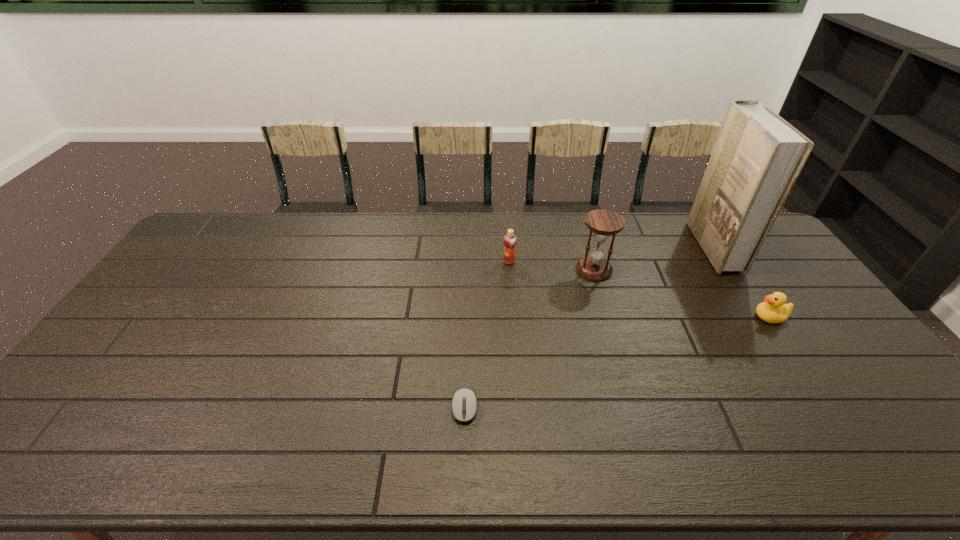
This screenshot has width=960, height=540. Find the location of `free space between the third object from right to left and the leftmost object`. free space between the third object from right to left and the leftmost object is located at coordinates (529, 338).

Identify the location of free spot between the tallest object and the second object from left to right. (612, 254).

In order to click on blank region between the duck and the fourth object from right to left in this screenshot , I will do `click(639, 289)`.

Find the location of a particular element. The image size is (960, 540). free space between the tallest object and the second object from left to right is located at coordinates (612, 254).

The height and width of the screenshot is (540, 960). In order to click on unoccupied area between the second nearest object and the phonebook in this screenshot , I will do `click(742, 282)`.

Where is `empty space between the third object from left to right and the phonebook`? empty space between the third object from left to right and the phonebook is located at coordinates (654, 258).

Select which object appears as the second closest to the computer equipment. Please provide its 2D coordinates. Your answer should be formatted as a tuple, i.e. [(x, y)], where the tuple contains the x and y coordinates of a point satisfying the conditions above.

[(603, 223)]

Locate an element on the screen. The image size is (960, 540). object identified as the second closest to the hourglass is located at coordinates (757, 157).

At what (x,y) coordinates should I click in order to perform the action: click on vacant space that satisfies the following two spatial constraints: 1. at the beak of the fourth farthest object; 2. on the wheel side of the leftmost object. Please return your answer as a coordinate pair (x, y). The height and width of the screenshot is (540, 960). Looking at the image, I should click on (828, 406).

Find the location of a particular element. This screenshot has height=540, width=960. free region that satisfies the following two spatial constraints: 1. at the beak of the duck; 2. on the wheel side of the leftmost object is located at coordinates (828, 406).